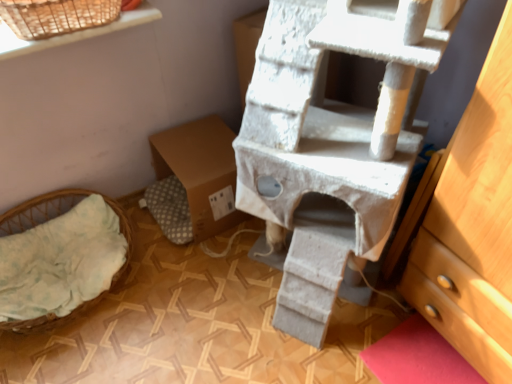
Identify the location of vacant space to the right of light green fabric basket at lower left. (176, 307).